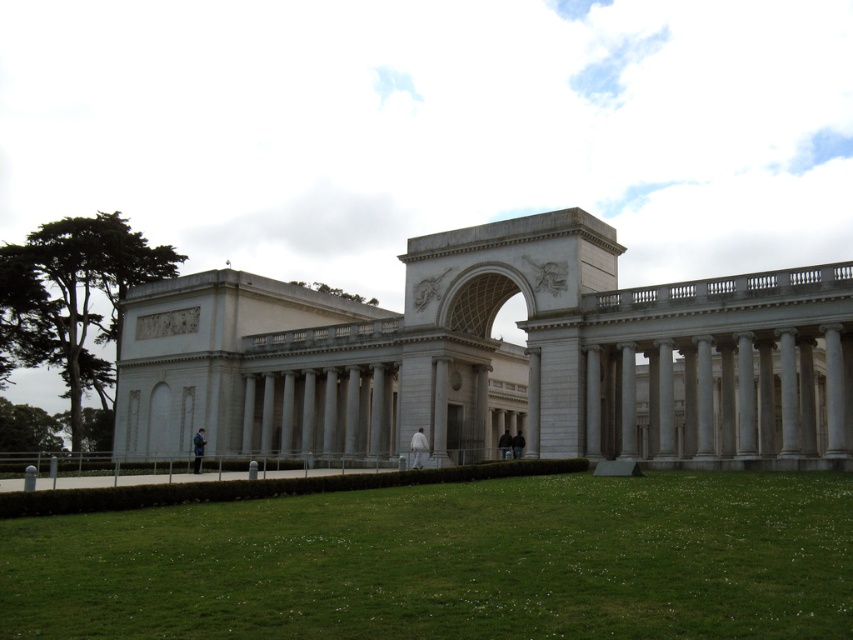
In the scene shown: Does white stone palace at center lie in front of green grass at lower center?

No, it is not.

Between white stone palace at center and green grass at lower center, which one has less height?

green grass at lower center is shorter.

Between point (161, 404) and point (107, 579), which one is positioned in front?

Positioned in front is point (107, 579).

This screenshot has width=853, height=640. Identify the location of white stone palace at center. (494, 356).